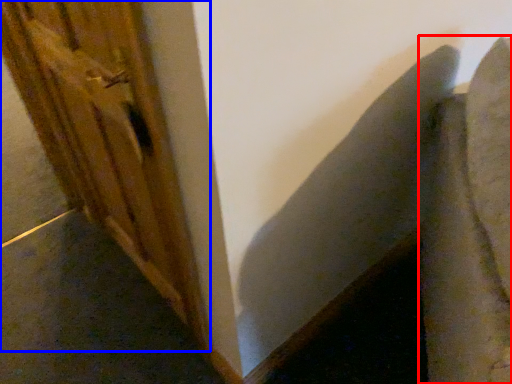
Question: Which of the following is the closest to the observer, swivel chair (highlighted by a red box) or barn door (highlighted by a blue box)?

Choices:
 (A) swivel chair
 (B) barn door

Answer: (A)